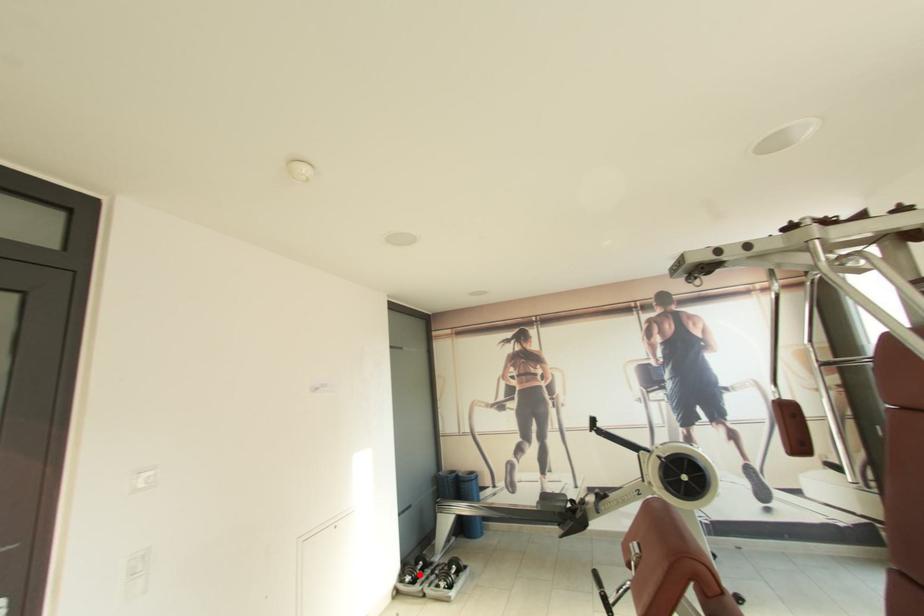
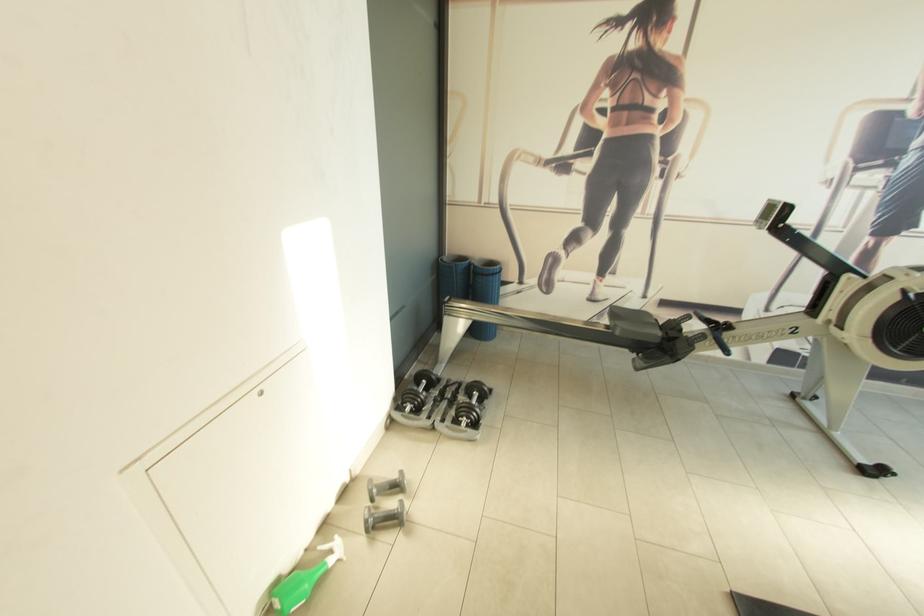
Question: I am providing you with two images of the same scene from different viewpoints. Given a red point in image1, look at the same physical point in image2. Is it:

Choices:
 (A) Closer to the viewpoint
 (B) Farther from the viewpoint

Answer: (B)